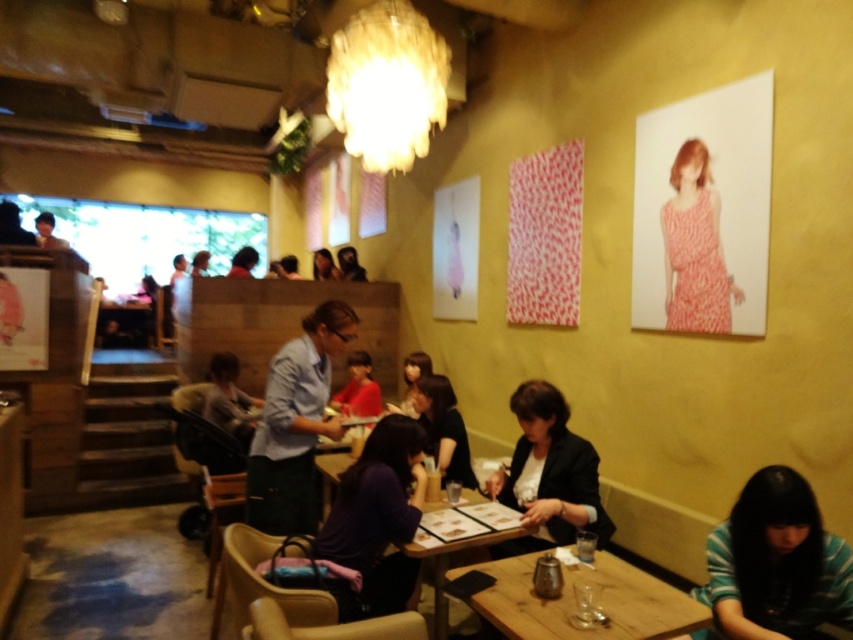
Question: Does striped cotton shirt at lower right have a lesser width compared to matte black hair at center?

Choices:
 (A) no
 (B) yes

Answer: (A)

Question: Can you confirm if wooden table at lower right is positioned below matte black hair at center?

Choices:
 (A) no
 (B) yes

Answer: (B)

Question: Which object appears closest to the camera in this image?

Choices:
 (A) pink dotted dress at upper right
 (B) matte black shirt at upper left

Answer: (A)

Question: Which object appears farthest from the camera in this image?

Choices:
 (A) striped cotton shirt at lower right
 (B) wooden table at lower right
 (C) black matte blazer at center
 (D) smooth skin face at upper left

Answer: (D)

Question: Which point is farther to the camera?

Choices:
 (A) (180, 262)
 (B) (386, 404)

Answer: (A)

Question: Does matte black hair at center appear over matte black shirt at upper center?

Choices:
 (A) yes
 (B) no

Answer: (B)